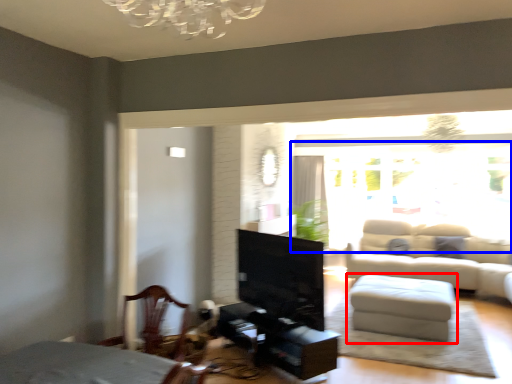
Question: Which of the following is the farthest to the observer, table (highlighted by a red box) or window screen (highlighted by a blue box)?

Choices:
 (A) table
 (B) window screen

Answer: (B)